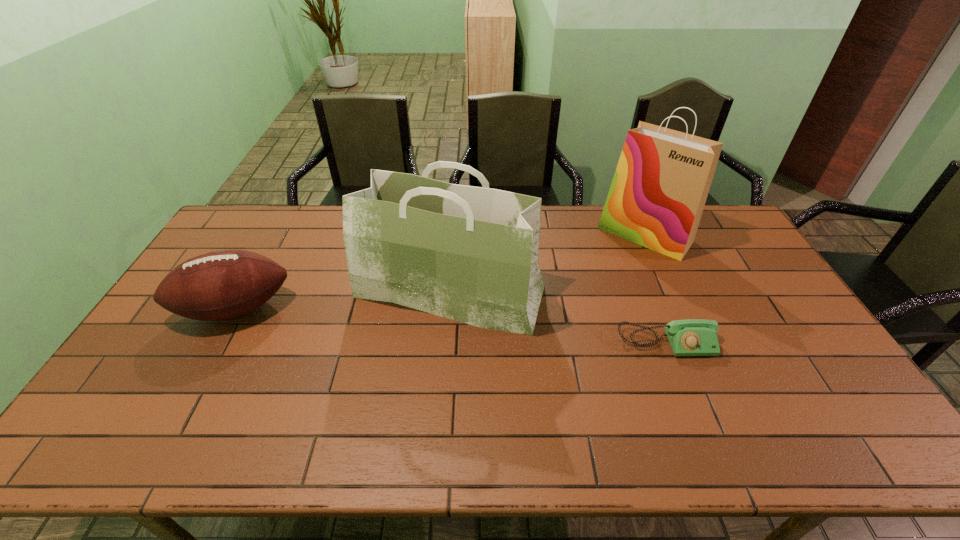
Image resolution: width=960 pixels, height=540 pixels. What are the coordinates of `shopping bag` in the screenshot? It's located at (657, 196).

Where is `the second object from left to right`? the second object from left to right is located at coordinates (470, 254).

Where is `football (American)`? football (American) is located at coordinates (221, 285).

At what (x,y) coordinates should I click in order to perform the action: click on the leftmost object. Please return your answer as a coordinate pair (x, y). Looking at the image, I should click on click(x=221, y=285).

The width and height of the screenshot is (960, 540). In order to click on telephone in this screenshot , I will do `click(692, 337)`.

The width and height of the screenshot is (960, 540). I want to click on free region located on the left of the shopping bag, so click(x=497, y=234).

You are a GUI agent. You are given a task and a screenshot of the screen. Output one action in this format:
    pyautogui.click(x=<x>, y=<y>)
    Task: Click on the vacant space located on the front of the grocery bag
    This screenshot has height=540, width=960.
    Given the screenshot: What is the action you would take?
    (439, 456)

Where is `free location located on the right of the leftmost object`? free location located on the right of the leftmost object is located at coordinates (357, 309).

The width and height of the screenshot is (960, 540). Identify the location of free spot located 0.160m on the dial of the telephone. (693, 411).

Identify the location of object that is at the far edge. The image size is (960, 540). (657, 196).